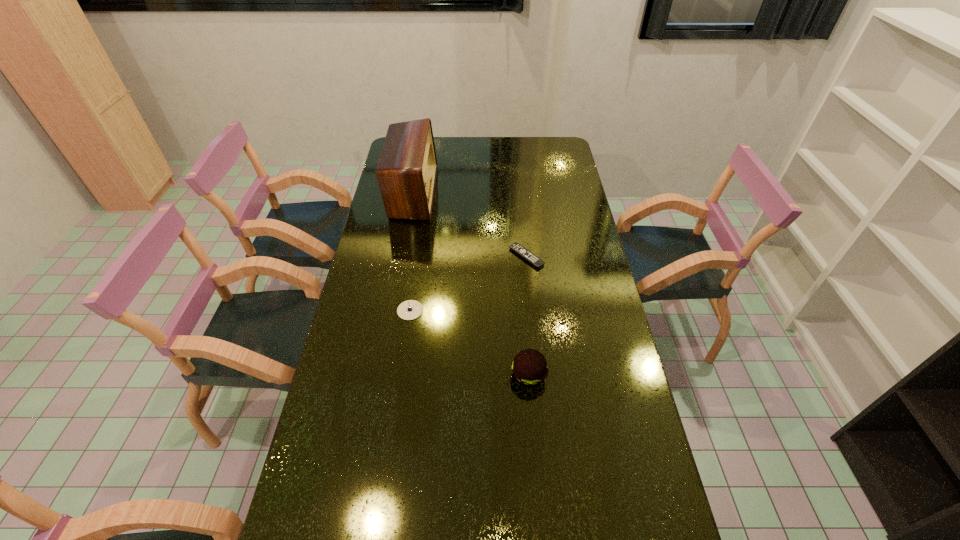
You are a GUI agent. You are given a task and a screenshot of the screen. Output one action in this format:
    pyautogui.click(x=<x>, y=<y>)
    Task: Click on the free space located 0.230m on the back of the second nearest object
    
    Given the screenshot: What is the action you would take?
    pyautogui.click(x=419, y=253)

Where is `vacant space located on the front of the second farthest object`? vacant space located on the front of the second farthest object is located at coordinates (537, 356).

Locate an element on the screen. radio receiver at the left edge is located at coordinates (406, 171).

This screenshot has height=540, width=960. In order to click on compass located in the left edge section of the desktop in this screenshot , I will do `click(408, 310)`.

In the image, there is a desktop. At what (x,y) coordinates should I click in order to perform the action: click on blank space at the far edge. Please return your answer as a coordinate pair (x, y). This screenshot has height=540, width=960. Looking at the image, I should click on (517, 143).

This screenshot has width=960, height=540. Find the location of `free space at the left edge`. free space at the left edge is located at coordinates (408, 223).

This screenshot has width=960, height=540. I want to click on free point at the right edge, so click(x=597, y=288).

Find the location of a particular element. free space at the far right corner of the desktop is located at coordinates (564, 144).

At what (x,y) coordinates should I click in order to perform the action: click on empty location between the nearest object and the remote control. Please return your answer as a coordinate pair (x, y). This screenshot has height=540, width=960. Looking at the image, I should click on (527, 316).

In order to click on free space between the shortest object and the nearest object in this screenshot , I will do `click(527, 316)`.